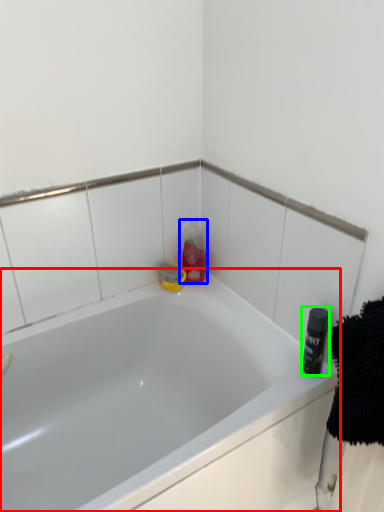
Question: Based on their relative distances, which object is nearer to bathtub (highlighted by a red box)? Choose from cleaning product (highlighted by a blue box) and toiletry (highlighted by a green box).

Choices:
 (A) cleaning product
 (B) toiletry

Answer: (A)